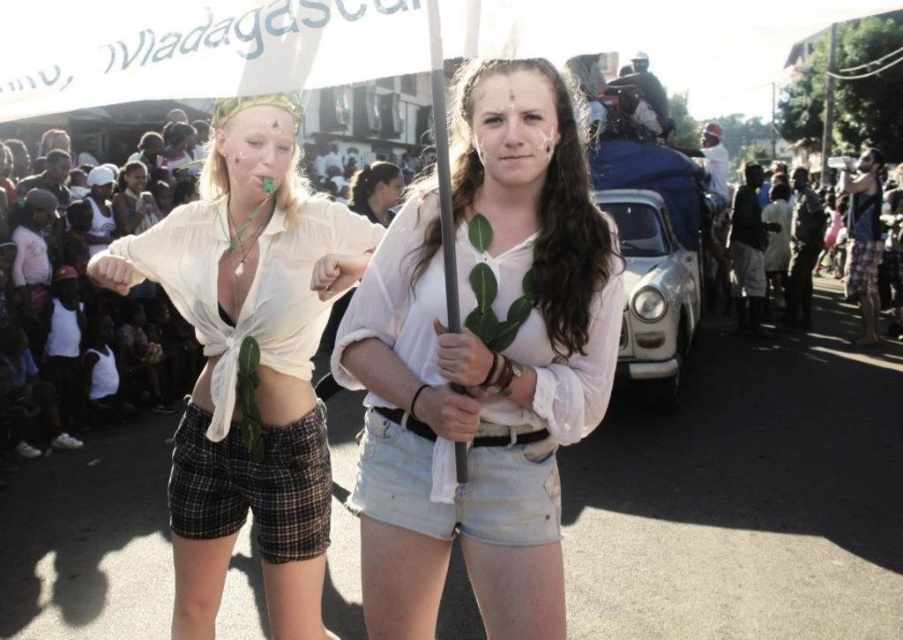
Question: Considering the real-world distances, which object is closest to the matte white blouse at center?

Choices:
 (A) white cotton shirt at center
 (B) dark skin people at right

Answer: (A)

Question: Is white cotton shirt at center smaller than dark skin people at right?

Choices:
 (A) no
 (B) yes

Answer: (B)

Question: Which point appears closest to the camera in this image?

Choices:
 (A) (857, 212)
 (B) (247, 120)

Answer: (B)

Question: Among these points, which one is farthest from the camera?

Choices:
 (A) (582, 164)
 (B) (349, 220)
 (C) (874, 166)

Answer: (C)

Question: In this image, where is white cotton shirt at center located relative to matte white blouse at center?

Choices:
 (A) right
 (B) left

Answer: (A)

Question: Can you confirm if white cotton shirt at center is smaller than dark skin people at right?

Choices:
 (A) yes
 (B) no

Answer: (A)